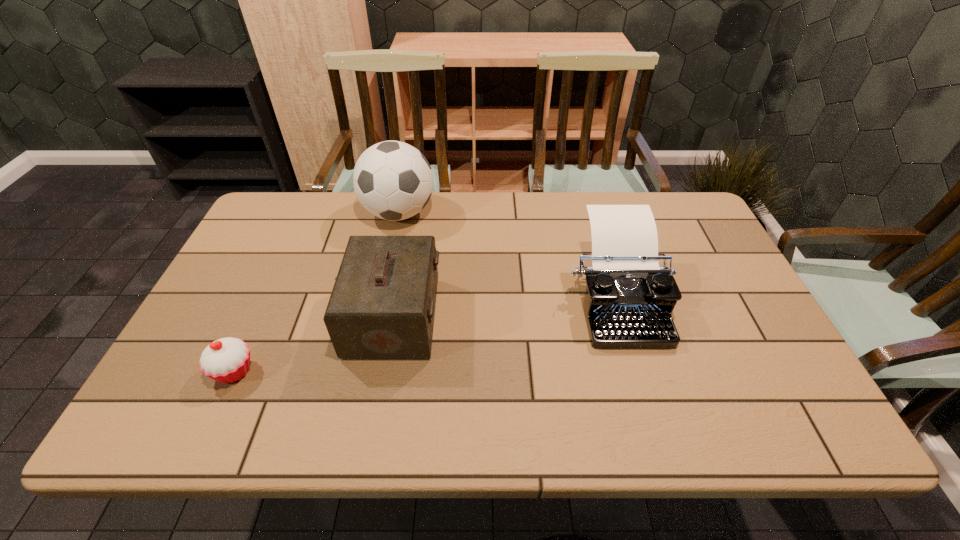
Identify the location of object at the far edge. (393, 180).

At what (x,y) coordinates should I click in order to perform the action: click on object situated at the left edge. Please return your answer as a coordinate pair (x, y). The width and height of the screenshot is (960, 540). Looking at the image, I should click on coord(227,360).

Image resolution: width=960 pixels, height=540 pixels. Identify the location of blank space at the far edge of the desktop. 304,233.

This screenshot has height=540, width=960. In the image, there is a desktop. Find the location of `vacant space at the near edge`. vacant space at the near edge is located at coordinates (714, 403).

In order to click on vacant space at the left edge of the desktop in this screenshot , I will do `click(248, 246)`.

In the image, there is a desktop. At what (x,y) coordinates should I click in order to perform the action: click on free space at the right edge. Please return your answer as a coordinate pair (x, y). Looking at the image, I should click on click(x=731, y=302).

Locate an element on the screen. free space that is in between the farthest object and the rightmost object is located at coordinates (507, 255).

I want to click on vacant space in between the cupcake and the first-aid kit, so (314, 344).

Find the location of a particular element. The height and width of the screenshot is (540, 960). vacant point located between the leftmost object and the first-aid kit is located at coordinates (314, 344).

The height and width of the screenshot is (540, 960). Find the location of `vacant point located between the typewriter and the first-aid kit`. vacant point located between the typewriter and the first-aid kit is located at coordinates (505, 307).